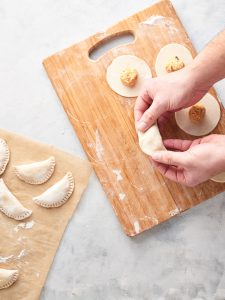
This screenshot has width=225, height=300. I want to click on wood cutting board, so click(x=154, y=207).